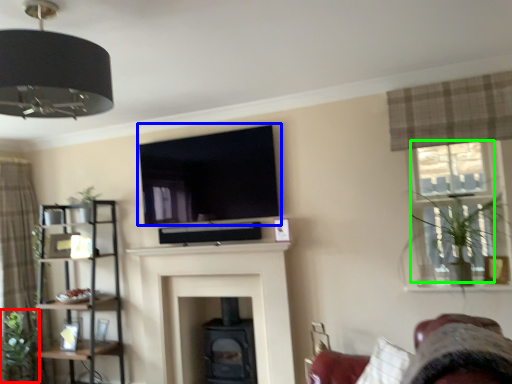
Question: Based on their relative distances, which object is farther from plant (highlighted by a red box)? Choose from window screen (highlighted by a blue box) and window (highlighted by a green box).

Choices:
 (A) window screen
 (B) window

Answer: (B)